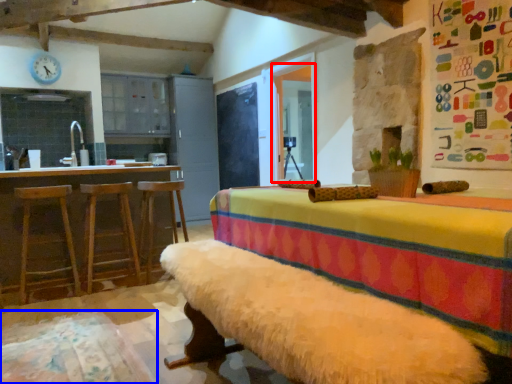
Question: Which object is closer to the camera taking this photo, window screen (highlighted by a red box) or bedding (highlighted by a blue box)?

Choices:
 (A) window screen
 (B) bedding

Answer: (B)